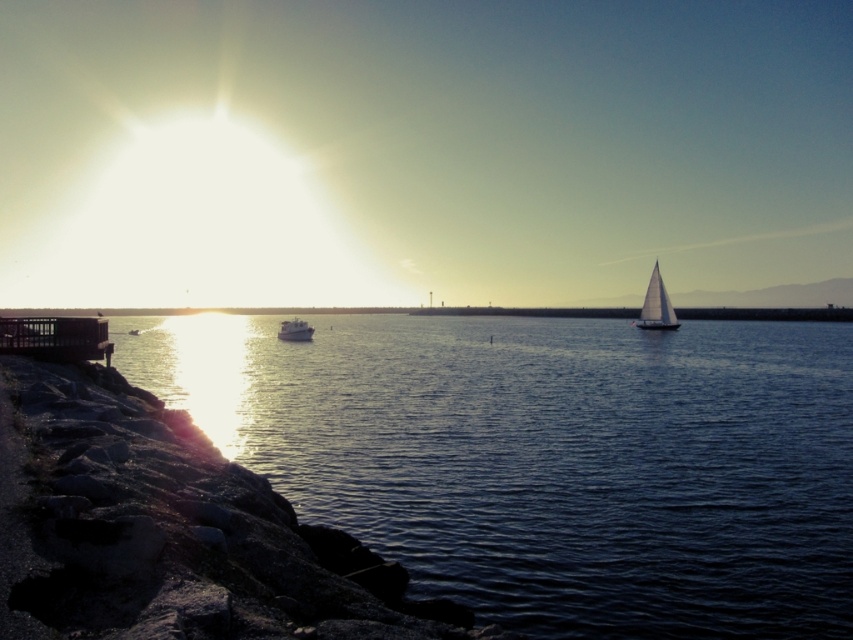
Question: Is white sailboat at right smaller than metallic silver boat at center?

Choices:
 (A) yes
 (B) no

Answer: (B)

Question: In this image, where is white sailboat at right located relative to metallic silver boat at center?

Choices:
 (A) below
 (B) above

Answer: (B)

Question: Among these objects, which one is nearest to the camera?

Choices:
 (A) metallic silver boat at center
 (B) white sailboat at right

Answer: (A)

Question: Can you confirm if white sailboat at right is positioned to the left of metallic silver boat at center?

Choices:
 (A) no
 (B) yes

Answer: (A)

Question: Which object appears farthest from the camera in this image?

Choices:
 (A) metallic silver boat at center
 (B) white sailboat at right

Answer: (B)